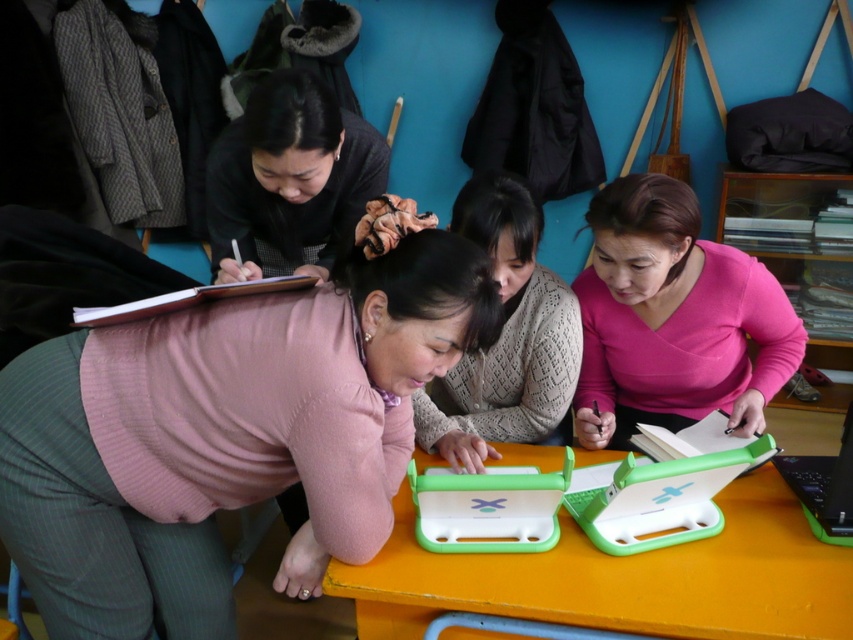
In the scene shown: You are a tailor measuring the distance between two sweaters on a table for a display. The sweaters are the pink ribbed sweater at center and the pink matte sweater at center. The display requires that the sweaters be at least 20 inches apart. Can you confirm if the current placement meets the requirement?

The pink ribbed sweater at center is 25.81 inches away from the pink matte sweater at center, which exceeds the minimum requirement of 20 inches. Therefore, the current placement meets the display requirement.